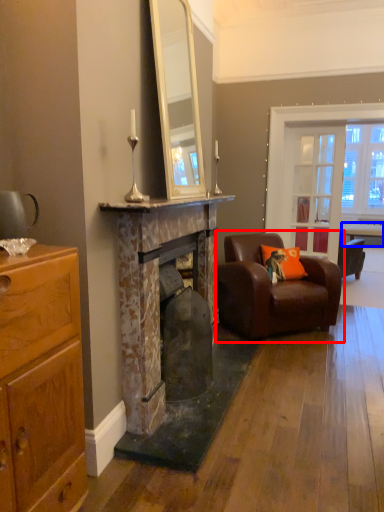
Question: Among these objects, which one is farthest to the camera, chair (highlighted by a red box) or table (highlighted by a blue box)?

Choices:
 (A) chair
 (B) table

Answer: (B)